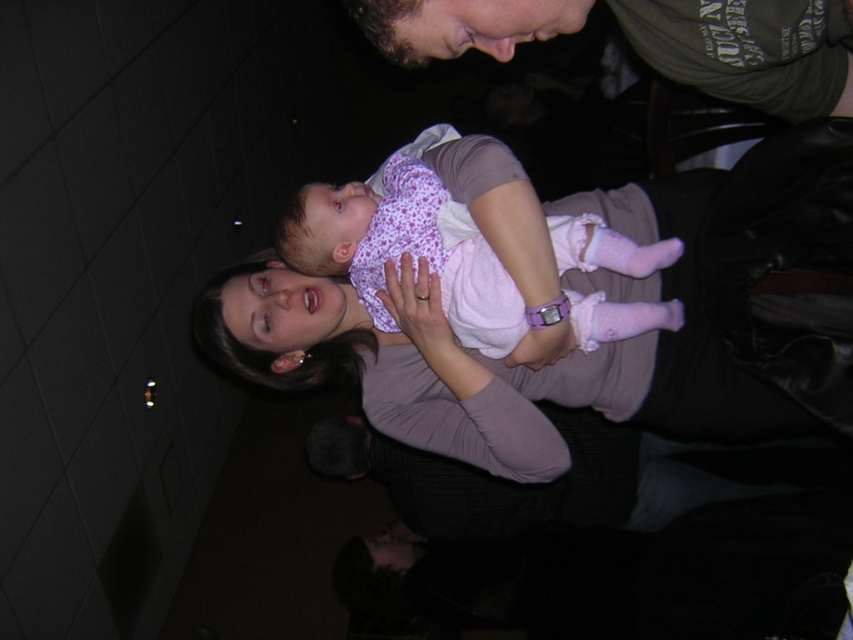
Does pink fabric baby at center appear on the left side of dark green t-shirt at upper right?

Indeed, pink fabric baby at center is positioned on the left side of dark green t-shirt at upper right.

Is pink fabric baby at center in front of dark green t-shirt at upper right?

No, it is behind dark green t-shirt at upper right.

Is point (692, 179) in front of point (728, 64)?

No, it is not.

Locate an element on the screen. The height and width of the screenshot is (640, 853). pink fabric baby at center is located at coordinates (474, 353).

From the picture: Does dark gray sweater at center come in front of purple matte arm at center?

No, it is behind purple matte arm at center.

Is point (755, 628) closer to viewer compared to point (422, 332)?

No, it is not.

Find the location of `dark gray sweater at center`. dark gray sweater at center is located at coordinates (743, 566).

Is purple dotted fabric at center below purple matte arm at center?

No.

The width and height of the screenshot is (853, 640). Find the location of `purple dotted fabric at center`. purple dotted fabric at center is located at coordinates click(x=473, y=250).

The width and height of the screenshot is (853, 640). Find the location of `purple dotted fabric at center`. purple dotted fabric at center is located at coordinates (473, 250).